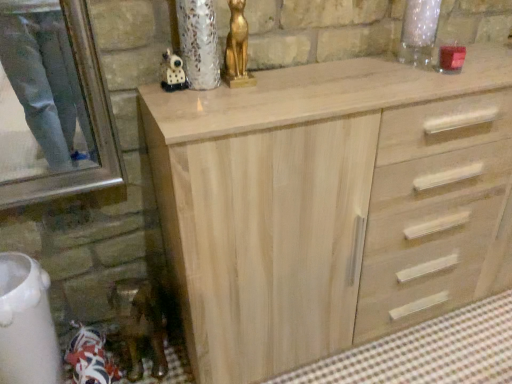
Question: From a real-world perspective, is natural wood cabinet at center positioned above or below matte black figurine at upper center, the first miniature from the front?

Choices:
 (A) above
 (B) below

Answer: (B)

Question: Would you say natural wood cabinet at center is to the left or to the right of matte black figurine at upper center, positioned as the 1th miniature in right-to-left order, in the picture?

Choices:
 (A) left
 (B) right

Answer: (B)

Question: Based on their relative distances, which object is nearer to the metallic gold figurine at lower left, which ranks as the first miniature in back-to-front order?

Choices:
 (A) gold metallic cat statue at upper center
 (B) matte black figurine at upper center, which is the 2th miniature in back-to-front order
 (C) natural wood cabinet at center

Answer: (C)

Question: Estimate the real-world distances between objects in this image. Which object is farther from the natural wood cabinet at center?

Choices:
 (A) metallic gold figurine at lower left, positioned as the 2th miniature in front-to-back order
 (B) matte black figurine at upper center, which is the 2th miniature in back-to-front order
 (C) gold metallic cat statue at upper center

Answer: (B)